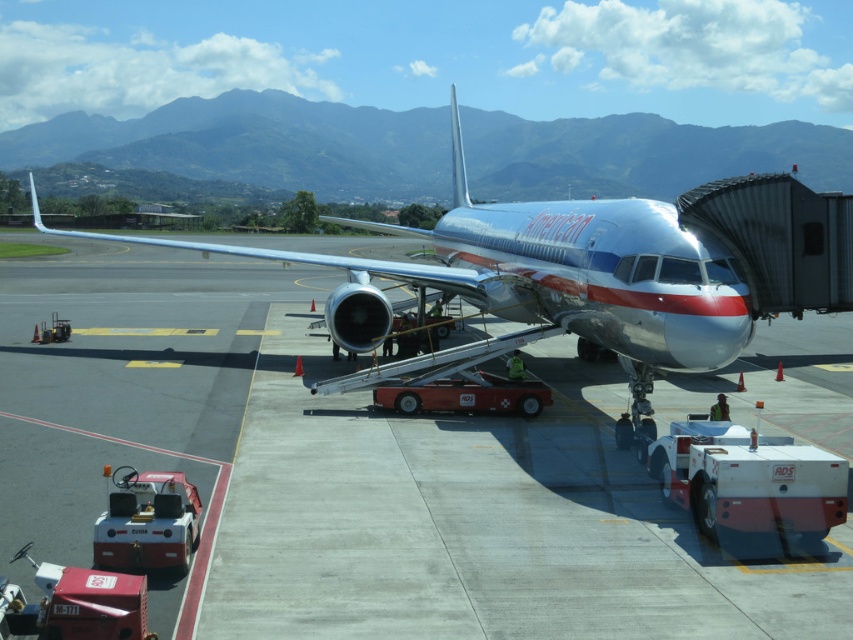
Who is more distant from viewer, (287, 285) or (590, 324)?

Positioned behind is point (287, 285).

Based on the photo, does smooth concrete tarmac at center have a smaller size compared to silver metallic airplane at center?

Yes.

Where is `smooth concrete tarmac at center`? This screenshot has width=853, height=640. smooth concrete tarmac at center is located at coordinates (350, 472).